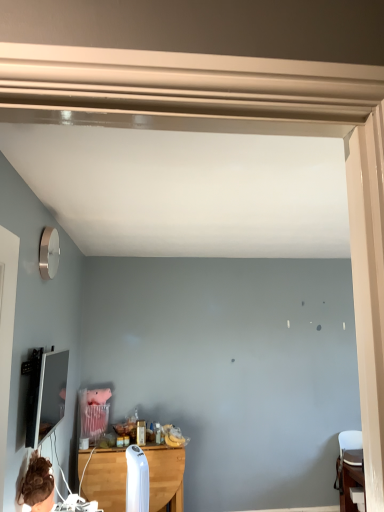
Question: From a real-world perspective, is wooden table at center, the second table when ordered from right to left, located higher than wooden table at lower right, positioned as the 1th table in right-to-left order?

Choices:
 (A) yes
 (B) no

Answer: (A)

Question: Is wooden table at center, the first table in the left-to-right sequence, positioned behind wooden table at lower right, positioned as the 1th table in right-to-left order?

Choices:
 (A) yes
 (B) no

Answer: (B)

Question: From a real-world perspective, is wooden table at center, the first table in the left-to-right sequence, positioned under wooden table at lower right, positioned as the 1th table in right-to-left order, based on gravity?

Choices:
 (A) yes
 (B) no

Answer: (B)

Question: Can you confirm if wooden table at center, the first table in the left-to-right sequence, is bigger than wooden table at lower right, which appears as the second table when viewed from the left?

Choices:
 (A) no
 (B) yes

Answer: (B)

Question: From the image's perspective, would you say wooden table at center, the first table in the left-to-right sequence, is shown under wooden table at lower right, positioned as the 1th table in right-to-left order?

Choices:
 (A) yes
 (B) no

Answer: (B)

Question: Is wooden table at center, the second table when ordered from right to left, facing towards wooden table at lower right, which appears as the second table when viewed from the left?

Choices:
 (A) yes
 (B) no

Answer: (B)

Question: Does wooden table at lower right, positioned as the 1th table in right-to-left order, have a lesser width compared to wooden table at center, the first table in the left-to-right sequence?

Choices:
 (A) yes
 (B) no

Answer: (B)

Question: Is wooden table at lower right, which appears as the second table when viewed from the left, to the right of wooden table at center, the first table in the left-to-right sequence, from the viewer's perspective?

Choices:
 (A) no
 (B) yes

Answer: (B)

Question: Can you confirm if wooden table at lower right, positioned as the 1th table in right-to-left order, is taller than wooden table at center, the first table in the left-to-right sequence?

Choices:
 (A) yes
 (B) no

Answer: (B)

Question: Considering the relative positions of wooden table at lower right, which appears as the second table when viewed from the left, and wooden table at center, the first table in the left-to-right sequence, in the image provided, is wooden table at lower right, which appears as the second table when viewed from the left, to the left of wooden table at center, the first table in the left-to-right sequence, from the viewer's perspective?

Choices:
 (A) no
 (B) yes

Answer: (A)

Question: Is wooden table at lower right, positioned as the 1th table in right-to-left order, positioned far away from wooden table at center, the first table in the left-to-right sequence?

Choices:
 (A) no
 (B) yes

Answer: (B)

Question: From the image's perspective, is wooden table at lower right, which appears as the second table when viewed from the left, on wooden table at center, the second table when ordered from right to left?

Choices:
 (A) no
 (B) yes

Answer: (A)

Question: Is wooden table at center, the first table in the left-to-right sequence, at the left side of matte black tv at left?

Choices:
 (A) yes
 (B) no

Answer: (B)